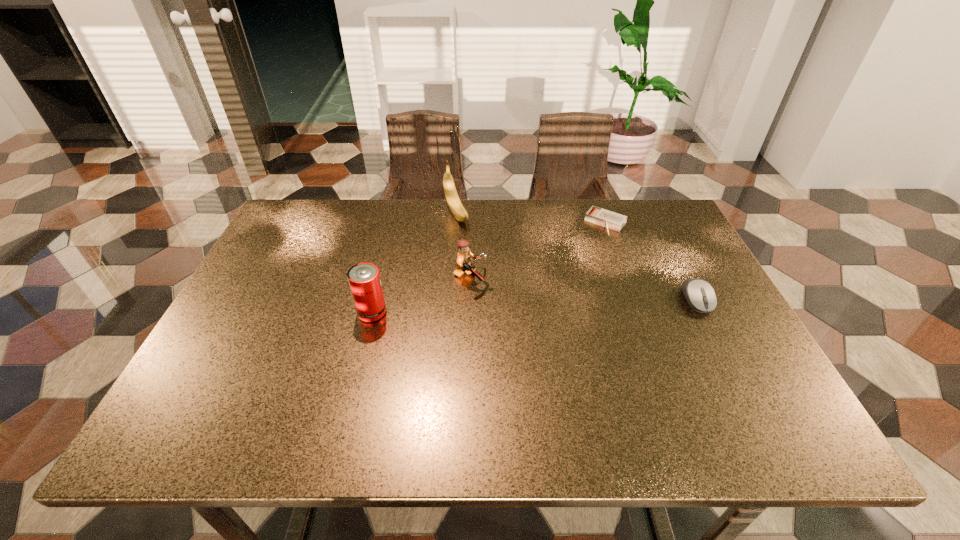
Where is `free space on the desktop that is between the leftmost object and the computer equipment and is positioned holding a crossbow in the hands of the Lego`? The height and width of the screenshot is (540, 960). free space on the desktop that is between the leftmost object and the computer equipment and is positioned holding a crossbow in the hands of the Lego is located at coordinates (543, 306).

You are a GUI agent. You are given a task and a screenshot of the screen. Output one action in this format:
    pyautogui.click(x=<x>, y=<y>)
    Task: Click on the free space on the desktop that is between the fourth shortest object and the rightmost object and is positioned at the start of the peel on the tallest object
    This screenshot has height=540, width=960.
    Given the screenshot: What is the action you would take?
    pyautogui.click(x=520, y=307)

Where is `vacant space on the desktop that is between the can and the rightmost object and is positioned on the striking surface of the shortest object`? The width and height of the screenshot is (960, 540). vacant space on the desktop that is between the can and the rightmost object and is positioned on the striking surface of the shortest object is located at coordinates (542, 306).